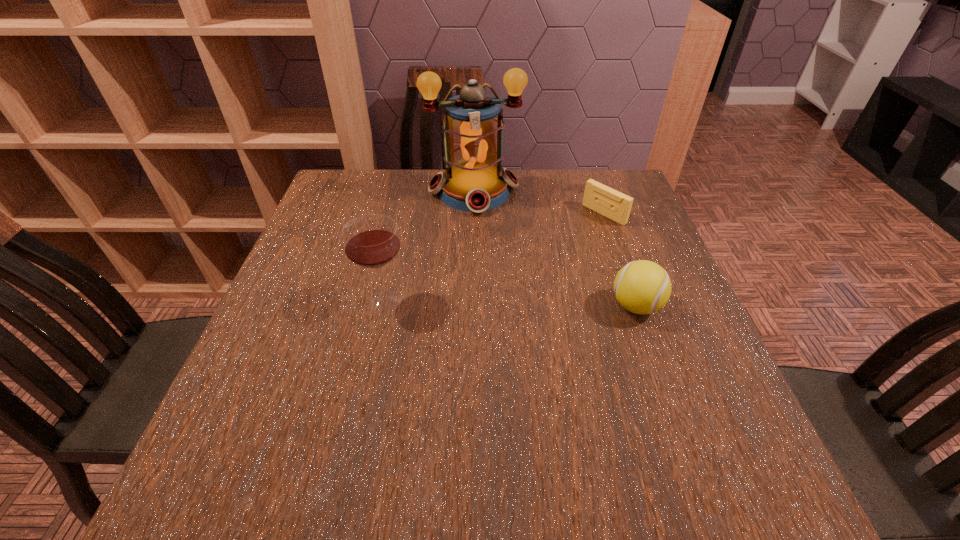
Locate an element on the screen. This screenshot has height=540, width=960. vacant area situated at the front of the shortest object with spools is located at coordinates (554, 248).

Where is `vacant space located on the front-facing side of the third object from right to left`? This screenshot has width=960, height=540. vacant space located on the front-facing side of the third object from right to left is located at coordinates (492, 287).

Identify the location of vacant space located 0.100m on the front-facing side of the third object from right to left. (483, 240).

At what (x,y) coordinates should I click in order to perform the action: click on free space located on the front-facing side of the third object from right to left. Please return your answer as a coordinate pair (x, y). The image size is (960, 540). Looking at the image, I should click on (493, 293).

Where is `videotape located at the far edge`? Image resolution: width=960 pixels, height=540 pixels. videotape located at the far edge is located at coordinates (600, 198).

Identify the location of lantern at the far edge. (474, 180).

I want to click on tennis ball positioned at the right edge, so click(x=642, y=287).

Locate an element on the screen. videotape present at the right edge is located at coordinates (600, 198).

Locate an element on the screen. object that is at the far right corner is located at coordinates (600, 198).

Identify the location of vacant space at the far edge of the desktop. (535, 174).